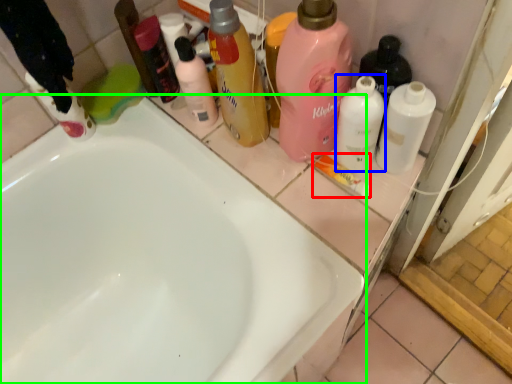
Question: Which object is the farthest from toothpaste (highlighted by a red box)? Choose among these: cleaning product (highlighted by a blue box) or bathtub (highlighted by a green box).

Choices:
 (A) cleaning product
 (B) bathtub

Answer: (B)